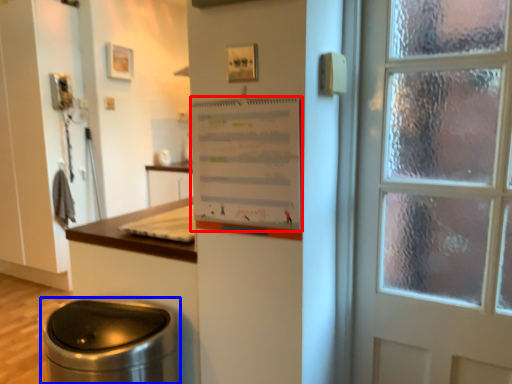
Question: Which point is closer to the camera, poster (highlighted by a red box) or waste container (highlighted by a blue box)?

Choices:
 (A) poster
 (B) waste container

Answer: (A)